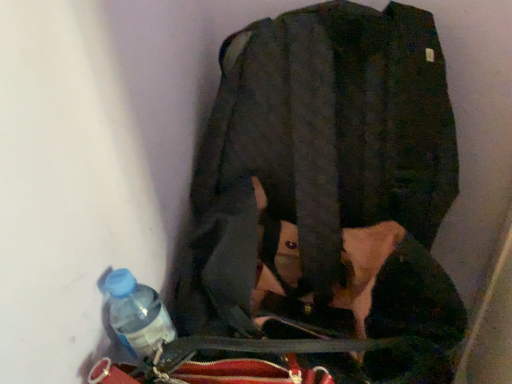
Where is `matte black jacket at center`? The width and height of the screenshot is (512, 384). matte black jacket at center is located at coordinates (328, 175).

What do you see at coordinates (328, 175) in the screenshot?
I see `matte black jacket at center` at bounding box center [328, 175].

At what (x,y) coordinates should I click in order to perform the action: click on translucent plastic bottle at lower left. Please return your answer as a coordinate pair (x, y). Image resolution: width=512 pixels, height=384 pixels. Looking at the image, I should click on (137, 314).

Describe the element at coordinates (137, 314) in the screenshot. I see `translucent plastic bottle at lower left` at that location.

Where is `matte black jacket at center`? matte black jacket at center is located at coordinates (328, 175).

Which is more to the left, translucent plastic bottle at lower left or matte black jacket at center?

translucent plastic bottle at lower left.

Between translucent plastic bottle at lower left and matte black jacket at center, which one is positioned in front?

matte black jacket at center is more forward.

Between point (115, 275) and point (419, 34), which one is positioned in front?

The point (419, 34) is in front.

From the image's perspective, would you say translucent plastic bottle at lower left is positioned over matte black jacket at center?

No.

From a real-world perspective, is translucent plastic bottle at lower left on top of matte black jacket at center?

Actually, translucent plastic bottle at lower left is physically below matte black jacket at center in the real world.

Considering the sizes of translucent plastic bottle at lower left and matte black jacket at center in the image, is translucent plastic bottle at lower left wider or thinner than matte black jacket at center?

Considering their sizes, translucent plastic bottle at lower left looks slimmer than matte black jacket at center.

From the picture: Is translucent plastic bottle at lower left taller or shorter than matte black jacket at center?

Clearly, translucent plastic bottle at lower left is shorter compared to matte black jacket at center.

Between translucent plastic bottle at lower left and matte black jacket at center, which one has larger size?

Bigger between the two is matte black jacket at center.

Would you say translucent plastic bottle at lower left contains matte black jacket at center?

That's incorrect, matte black jacket at center is not inside translucent plastic bottle at lower left.

Are translucent plastic bottle at lower left and matte black jacket at center located far from each other?

translucent plastic bottle at lower left is actually quite close to matte black jacket at center.

Based on the photo, is translucent plastic bottle at lower left aimed at matte black jacket at center?

No, translucent plastic bottle at lower left is not oriented towards matte black jacket at center.

What's the angular difference between translucent plastic bottle at lower left and matte black jacket at center's facing directions?

They differ by 0.000346 degrees in their facing directions.

How distant is translucent plastic bottle at lower left from matte black jacket at center?

translucent plastic bottle at lower left and matte black jacket at center are 10.34 inches apart.

Where is `jacket above the translucent plastic bottle at lower left (from the image's perspective)`? The height and width of the screenshot is (384, 512). jacket above the translucent plastic bottle at lower left (from the image's perspective) is located at coordinates (328, 175).

Does matte black jacket at center appear on the left side of translucent plastic bottle at lower left?

No.

Considering the positions of objects matte black jacket at center and translucent plastic bottle at lower left in the image provided, who is behind, matte black jacket at center or translucent plastic bottle at lower left?

translucent plastic bottle at lower left is behind.

Is point (371, 40) closer or farther from the camera than point (170, 329)?

Clearly, point (371, 40) is closer to the camera than point (170, 329).

From the image's perspective, is matte black jacket at center below translucent plastic bottle at lower left?

Actually, matte black jacket at center appears above translucent plastic bottle at lower left in the image.

From a real-world perspective, which object stands above the other?

matte black jacket at center is physically above.

Does matte black jacket at center have a lesser width compared to translucent plastic bottle at lower left?

Incorrect, the width of matte black jacket at center is not less than that of translucent plastic bottle at lower left.

Between matte black jacket at center and translucent plastic bottle at lower left, which one has less height?

translucent plastic bottle at lower left is shorter.

Considering the relative sizes of matte black jacket at center and translucent plastic bottle at lower left in the image provided, is matte black jacket at center bigger than translucent plastic bottle at lower left?

Yes, matte black jacket at center is bigger than translucent plastic bottle at lower left.

Would you say matte black jacket at center contains translucent plastic bottle at lower left?

No, translucent plastic bottle at lower left is not inside matte black jacket at center.

Are matte black jacket at center and translucent plastic bottle at lower left making contact?

No, matte black jacket at center is not with translucent plastic bottle at lower left.

Is matte black jacket at center positioned with its back to translucent plastic bottle at lower left?

No, matte black jacket at center is not facing away from translucent plastic bottle at lower left.

The width and height of the screenshot is (512, 384). Find the location of `jacket lying in front of the translucent plastic bottle at lower left`. jacket lying in front of the translucent plastic bottle at lower left is located at coordinates (328, 175).

Identify the location of bottle behind the matte black jacket at center. Image resolution: width=512 pixels, height=384 pixels. (137, 314).

I want to click on jacket in front of the translucent plastic bottle at lower left, so click(328, 175).